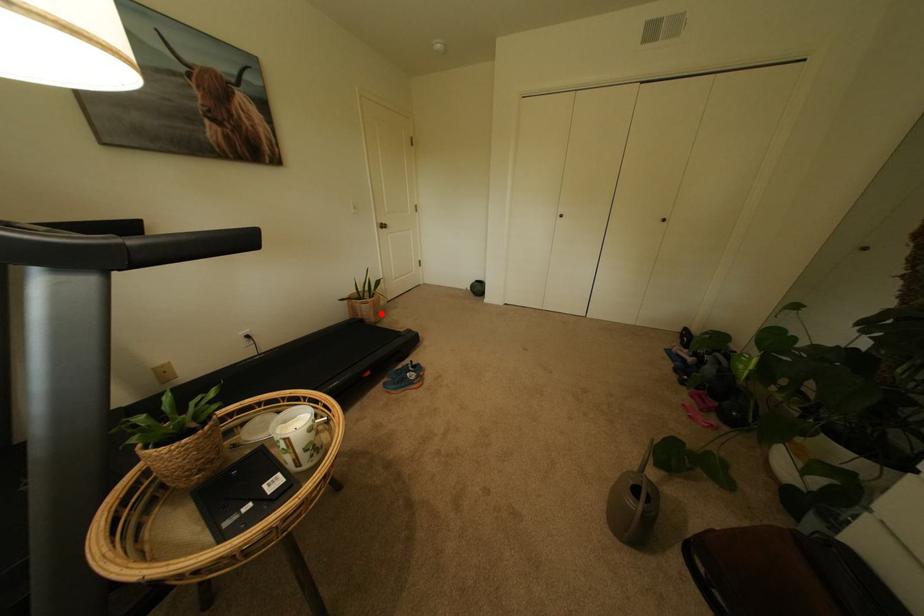
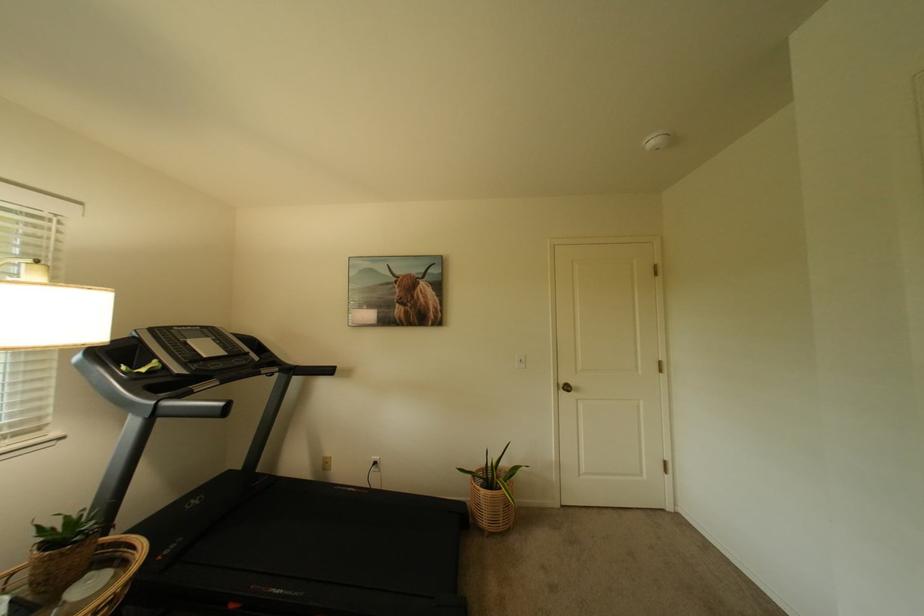
Question: I am providing you with two images of the same scene from different viewpoints. Given a red point in image1, look at the same physical point in image2. Is it:

Choices:
 (A) Closer to the viewpoint
 (B) Farther from the viewpoint

Answer: (B)